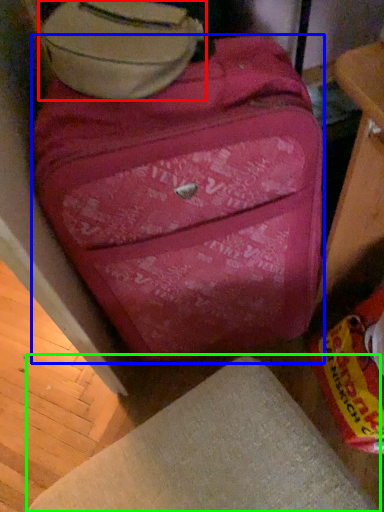
Question: Based on their relative distances, which object is nearer to luggage (highlighted by a red box)? Choose from suitcase (highlighted by a blue box) and furniture (highlighted by a green box).

Choices:
 (A) suitcase
 (B) furniture

Answer: (A)